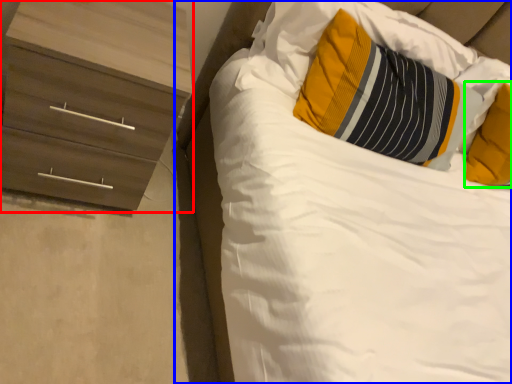
Question: Which is farther away from chest of drawers (highlighted by a red box)? bed (highlighted by a blue box) or pillow (highlighted by a green box)?

Choices:
 (A) bed
 (B) pillow

Answer: (B)